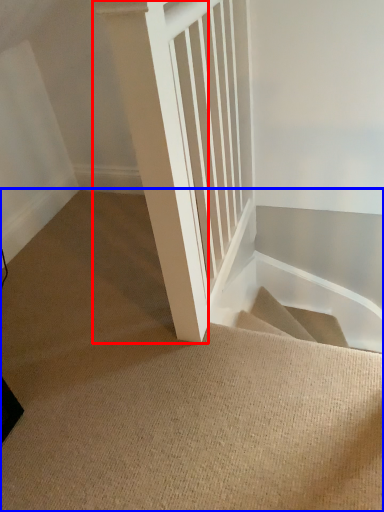
Question: Which object appears closest to the camera in this image, pillar (highlighted by a red box) or stairs (highlighted by a blue box)?

Choices:
 (A) pillar
 (B) stairs

Answer: (A)